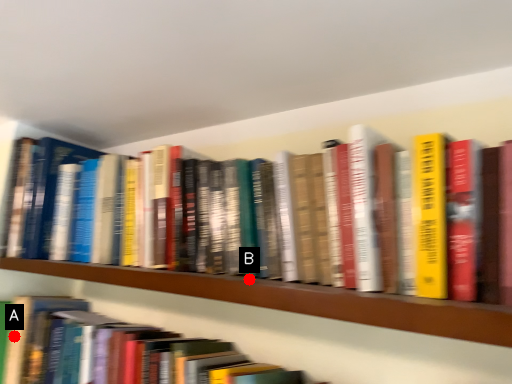
Question: Two points are circled on the image, labeled by A and B beside each circle. Which point is closer to the camera?

Choices:
 (A) A is closer
 (B) B is closer

Answer: (B)